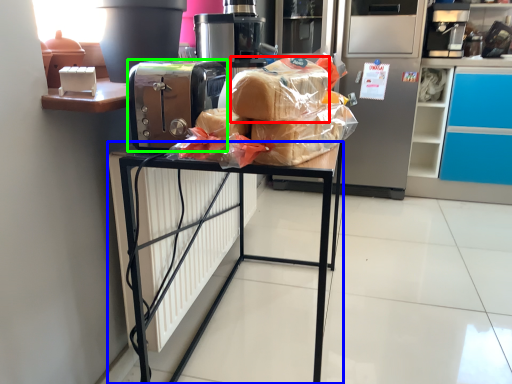
Question: Based on their relative distances, which object is nearer to bread (highlighted by a red box)? Choose from furniture (highlighted by a blue box) and home appliance (highlighted by a green box).

Choices:
 (A) furniture
 (B) home appliance

Answer: (B)